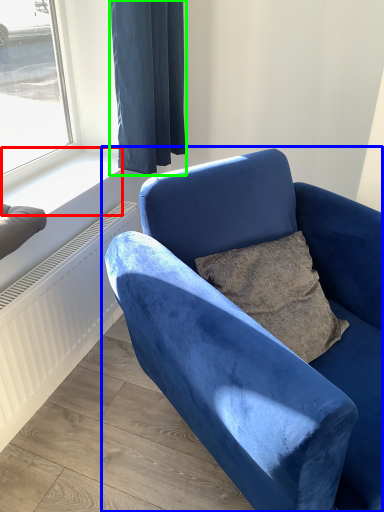
Question: Considering the real-world distances, which object is farthest from window sill (highlighted by a red box)? chair (highlighted by a blue box) or curtain (highlighted by a green box)?

Choices:
 (A) chair
 (B) curtain

Answer: (A)